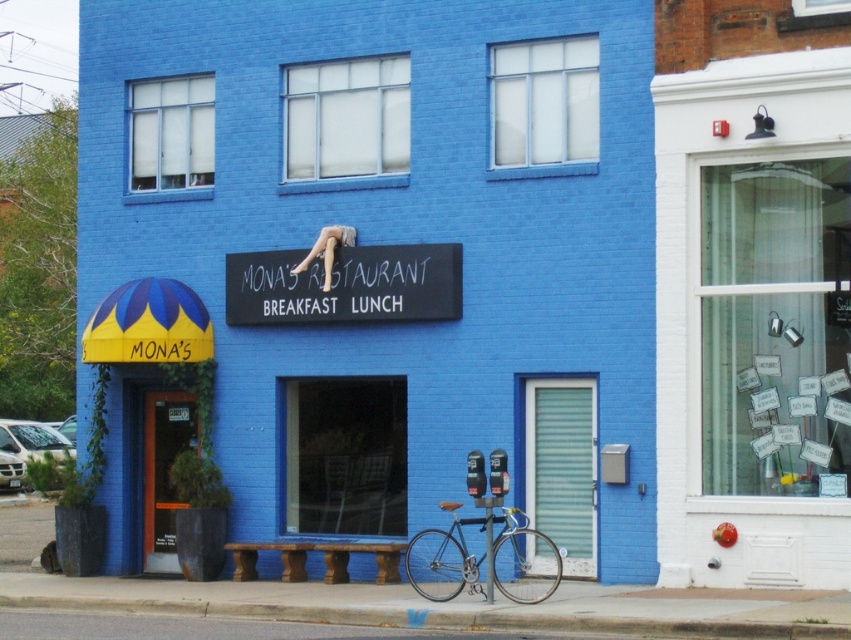
Who is shorter, white chalkboard sign at center or shiny silver bicycle at lower center?

With less height is white chalkboard sign at center.

Is white chalkboard sign at center shorter than shiny silver bicycle at lower center?

Yes, white chalkboard sign at center is shorter than shiny silver bicycle at lower center.

Is point (418, 282) behind point (500, 564)?

Yes, it is behind point (500, 564).

Identify the location of white chalkboard sign at center. Image resolution: width=851 pixels, height=640 pixels. (346, 285).

Describe the element at coordinates (393, 248) in the screenshot. I see `matte blue building at center` at that location.

What do you see at coordinates (393, 248) in the screenshot? I see `matte blue building at center` at bounding box center [393, 248].

Image resolution: width=851 pixels, height=640 pixels. What are the coordinates of `matte blue building at center` in the screenshot? It's located at (393, 248).

Who is more distant from viewer, (614, 512) or (505, 554)?

The point (505, 554) is behind.

This screenshot has width=851, height=640. Identify the location of matte blue building at center. [393, 248].